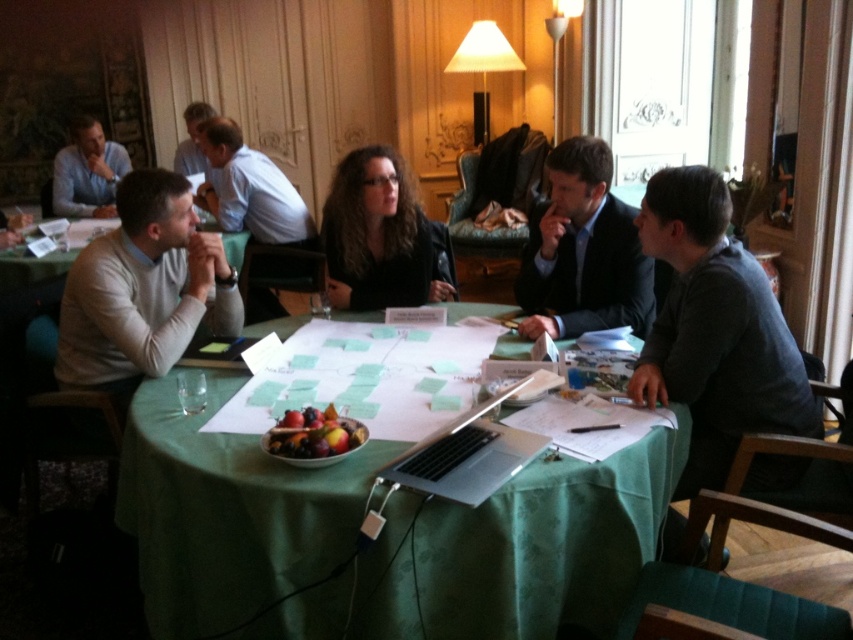
Who is more distant from viewer, (341, 189) or (462, 499)?

The point (341, 189) is more distant.

Can you confirm if black leather jacket at center is shorter than silver metallic laptop at center?

No, black leather jacket at center is not shorter than silver metallic laptop at center.

Find the location of a particular element. This screenshot has width=853, height=640. black leather jacket at center is located at coordinates (381, 237).

At what (x,y) coordinates should I click in order to perform the action: click on black leather jacket at center. Please return your answer as a coordinate pair (x, y). The height and width of the screenshot is (640, 853). Looking at the image, I should click on (381, 237).

Is silver metallic laptop at center in front of matte blue sweater at left?

That is True.

Where is `silver metallic laptop at center`? This screenshot has height=640, width=853. silver metallic laptop at center is located at coordinates (466, 454).

Which is in front, point (490, 481) or point (77, 115)?

Point (490, 481)

I want to click on silver metallic laptop at center, so click(466, 454).

Is point (283, 262) positioned behind point (418, 468)?

Yes, point (283, 262) is farther from viewer.

Can you confirm if light brown leather jacket at center is taller than silver metallic laptop at center?

Yes.

Between point (227, 132) and point (482, 461), which one is positioned behind?

Point (227, 132)

This screenshot has height=640, width=853. Identify the location of light brown leather jacket at center. (248, 189).